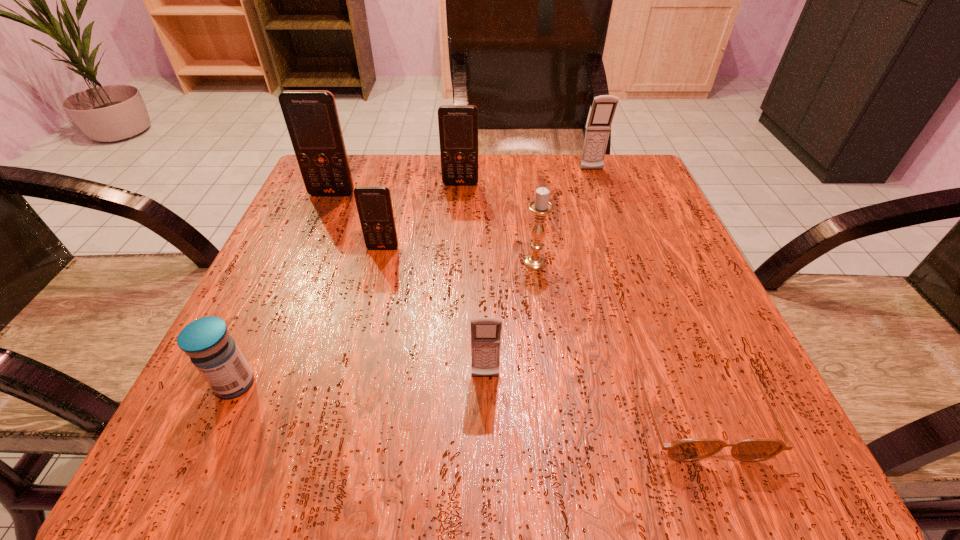
The image size is (960, 540). What are the coordinates of `vacant space situated on the screen of the second nearest cellular telephone` in the screenshot? It's located at (372, 293).

Locate an element on the screen. The height and width of the screenshot is (540, 960). vacant space located 0.120m on the front-facing side of the nearest cellular telephone is located at coordinates (487, 467).

Find the location of a particular element. The height and width of the screenshot is (540, 960). free space located on the back of the medicine is located at coordinates (277, 293).

The width and height of the screenshot is (960, 540). Find the location of `object located in the near edge section of the desktop`. object located in the near edge section of the desktop is located at coordinates 757,449.

Locate an element on the screen. cellular telephone at the left edge is located at coordinates (311, 117).

Identify the location of medicine situated at the left edge. The height and width of the screenshot is (540, 960). (214, 353).

Where is `cellular telephone at the right edge`? This screenshot has height=540, width=960. cellular telephone at the right edge is located at coordinates (603, 108).

Identify the location of sunglasses located at the right edge. This screenshot has height=540, width=960. (757, 449).

Identify the location of object that is at the far left corner. This screenshot has height=540, width=960. [x=311, y=117].

Identify the location of object that is at the far right corner. (603, 108).